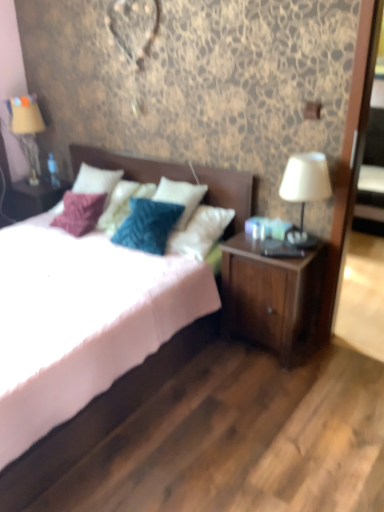
Question: Is the depth of white matte bed at center less than that of white fabric lampshade at right, the 1th table lamp positioned from the right?

Choices:
 (A) no
 (B) yes

Answer: (B)

Question: Is white matte bed at center at the left side of white fabric lampshade at right, which is counted as the second table lamp, starting from the back?

Choices:
 (A) yes
 (B) no

Answer: (A)

Question: Is white fabric lampshade at right, the 2th table lamp from the left, located within white matte bed at center?

Choices:
 (A) yes
 (B) no

Answer: (B)

Question: Can you confirm if white matte bed at center is thinner than white fabric lampshade at right, arranged as the second table lamp when viewed from the top?

Choices:
 (A) no
 (B) yes

Answer: (A)

Question: Is white matte bed at center far away from white fabric lampshade at right, the 1th table lamp ordered from the bottom?

Choices:
 (A) yes
 (B) no

Answer: (B)

Question: Considering their positions, is white matte bed at center located in front of or behind white fabric lampshade at right, the 1th table lamp positioned from the right?

Choices:
 (A) behind
 (B) front

Answer: (B)

Question: Considering the positions of white matte bed at center and white fabric lampshade at right, the 1th table lamp positioned from the right, in the image, is white matte bed at center bigger or smaller than white fabric lampshade at right, the 1th table lamp positioned from the right,?

Choices:
 (A) small
 (B) big

Answer: (B)

Question: Does point (185, 344) appear closer or farther from the camera than point (329, 186)?

Choices:
 (A) farther
 (B) closer

Answer: (A)

Question: Visually, is white matte bed at center positioned to the left or to the right of white fabric lampshade at right, which is the first table lamp from front to back?

Choices:
 (A) left
 (B) right

Answer: (A)

Question: Looking at the image, does matte beige fabric at left, the 2th table lamp from the right, seem bigger or smaller compared to wooden nightstand at lower right?

Choices:
 (A) small
 (B) big

Answer: (A)

Question: In the image, is matte beige fabric at left, marked as the 1th table lamp in a back-to-front arrangement, positioned in front of or behind wooden nightstand at lower right?

Choices:
 (A) front
 (B) behind

Answer: (B)

Question: In terms of width, does matte beige fabric at left, the 2th table lamp from the right, look wider or thinner when compared to wooden nightstand at lower right?

Choices:
 (A) wide
 (B) thin

Answer: (B)

Question: From a real-world perspective, is matte beige fabric at left, the 2th table lamp from the right, positioned above or below wooden nightstand at lower right?

Choices:
 (A) below
 (B) above

Answer: (B)

Question: Do you think white fabric lampshade at right, the 1th table lamp positioned from the right, is within wooden nightstand at lower right, or outside of it?

Choices:
 (A) inside
 (B) outside

Answer: (B)

Question: In terms of height, does white fabric lampshade at right, the 1th table lamp ordered from the bottom, look taller or shorter compared to wooden nightstand at lower right?

Choices:
 (A) short
 (B) tall

Answer: (A)